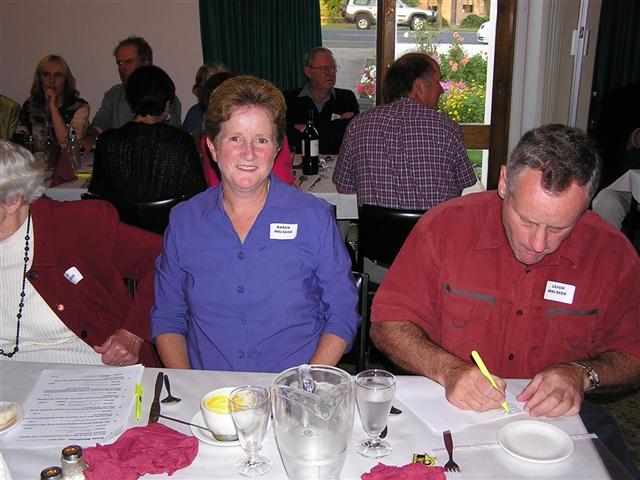
The height and width of the screenshot is (480, 640). Find the location of `chair back`. chair back is located at coordinates (381, 249).